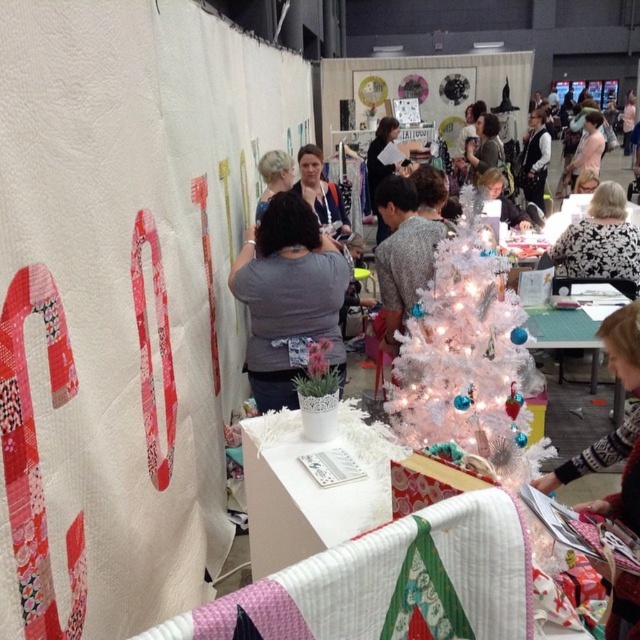
Does white glittery christmas tree at center have a smaller size compared to black and white sweater at center?

Incorrect, white glittery christmas tree at center is not smaller in size than black and white sweater at center.

Where is `white glittery christmas tree at center`? white glittery christmas tree at center is located at coordinates (458, 342).

Is point (385, 252) farther from camera compared to point (630, 262)?

No, it is in front of (630, 262).

You are a GUI agent. You are given a task and a screenshot of the screen. Output one action in this format:
    pyautogui.click(x=<x>, y=<y>)
    Task: Click on the white glittery christmas tree at center
    
    Given the screenshot: What is the action you would take?
    pyautogui.click(x=458, y=342)

Is quilted fabric at center to the right of blonde hair at center from the viewer's perspective?

Yes, quilted fabric at center is to the right of blonde hair at center.

Between quilted fabric at center and blonde hair at center, which one is positioned higher?

blonde hair at center is higher up.

Which is in front, point (490, 524) or point (257, 218)?

Point (490, 524) is more forward.

I want to click on quilted fabric at center, so click(x=388, y=582).

Who is positioned more to the left, quilted fabric at center or white glittery christmas tree at center?

Positioned to the left is quilted fabric at center.

Consider the image. Can you confirm if quilted fabric at center is shorter than white glittery christmas tree at center?

Indeed, quilted fabric at center has a lesser height compared to white glittery christmas tree at center.

The height and width of the screenshot is (640, 640). I want to click on quilted fabric at center, so click(388, 582).